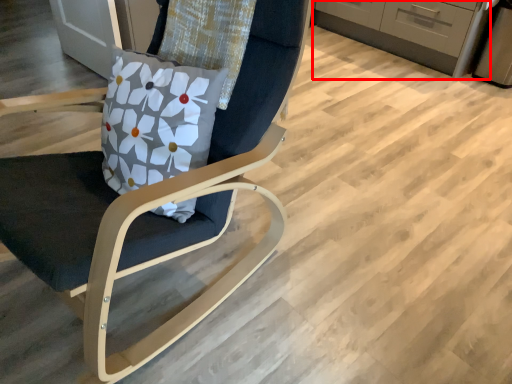
Question: From the image's perspective, considering the relative positions of cabinetry (annotated by the red box) and chair in the image provided, where is cabinetry (annotated by the red box) located with respect to the staircase?

Choices:
 (A) above
 (B) below

Answer: (A)